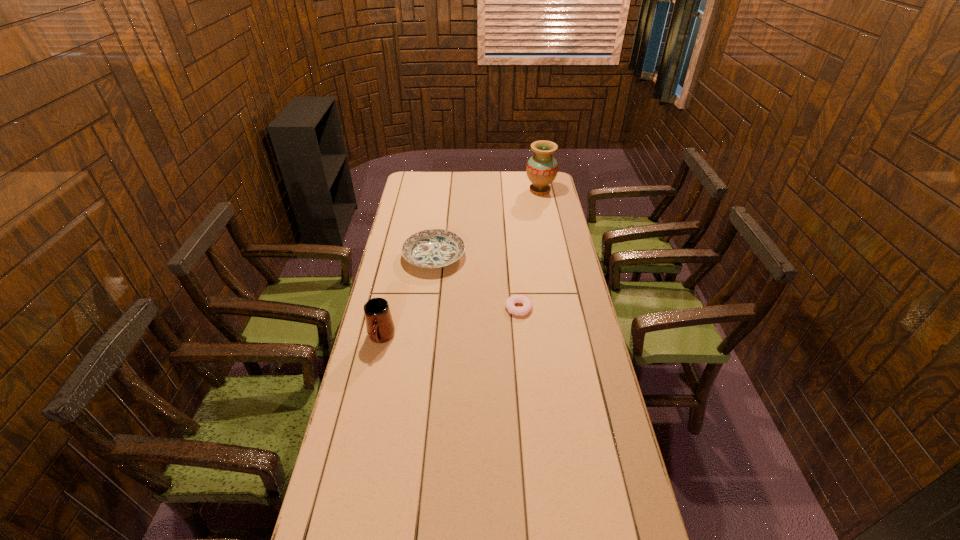
Find the location of a particular element. The image size is (960, 540). the farthest object is located at coordinates (542, 168).

Locate an element on the screen. The height and width of the screenshot is (540, 960). the rightmost object is located at coordinates (542, 168).

I want to click on mug, so click(x=380, y=327).

Image resolution: width=960 pixels, height=540 pixels. I want to click on the second tallest object, so click(380, 327).

Where is `plate`? plate is located at coordinates (433, 248).

I want to click on the second farthest object, so click(x=433, y=248).

Locate an element on the screen. The height and width of the screenshot is (540, 960). the third object from left to right is located at coordinates (510, 303).

Locate an element on the screen. Image resolution: width=960 pixels, height=540 pixels. the shortest object is located at coordinates (510, 303).

Where is `vacant space situated on the back of the vase`? vacant space situated on the back of the vase is located at coordinates (537, 172).

Image resolution: width=960 pixels, height=540 pixels. I want to click on vacant space located on the side of the mug with the handle, so click(364, 416).